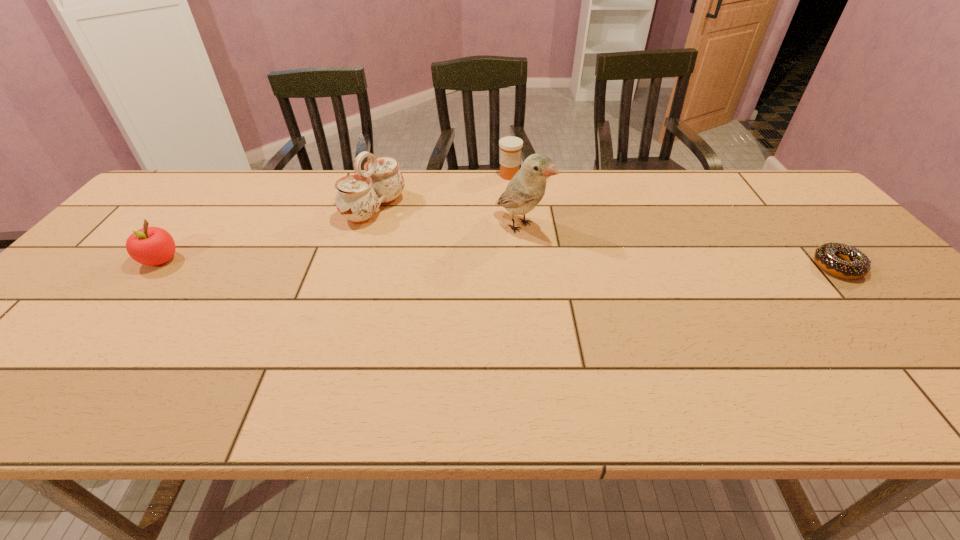
At what (x,y) coordinates should I click in order to perform the action: click on free spot on the desktop that is between the leftmost object and the rightmost object and is positioned by the handle of the second tallest object. Please return your answer as a coordinate pair (x, y). This screenshot has height=540, width=960. Looking at the image, I should click on (519, 264).

At what (x,y) coordinates should I click in order to perform the action: click on vacant space on the desktop that is between the leftmost object and the doughnut and is positioned at the face of the bird. Please return your answer as a coordinate pair (x, y). The image size is (960, 540). Looking at the image, I should click on (586, 264).

This screenshot has height=540, width=960. I want to click on free space on the desktop that is between the leftmost object and the shortest object and is positioned on the label of the farthest object, so click(461, 263).